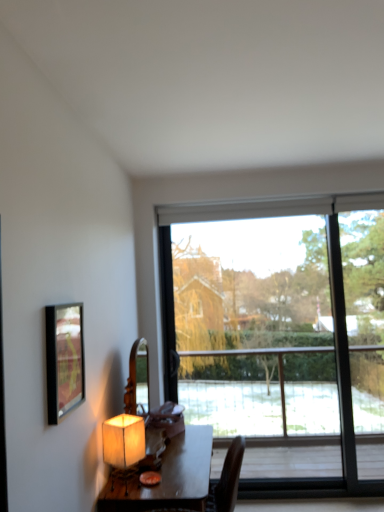
Measure the distance between matte beige lampshade at lower left and camera.

They are 6.83 feet apart.

This screenshot has height=512, width=384. What do you see at coordinates (64, 360) in the screenshot?
I see `metallic gold picture frame at upper left` at bounding box center [64, 360].

Find the location of `wooden table at center`. wooden table at center is located at coordinates (167, 477).

Considering the relative positions of metallic gold picture frame at upper left and transparent glass window at center in the image provided, is metallic gold picture frame at upper left to the left of transparent glass window at center from the viewer's perspective?

Correct, you'll find metallic gold picture frame at upper left to the left of transparent glass window at center.

Are metallic gold picture frame at upper left and transparent glass window at center beside each other?

metallic gold picture frame at upper left is not next to transparent glass window at center, and they're not touching.

Which point is more forward, (81,390) or (137,497)?

The point (81,390) is in front.

In the image, is metallic gold picture frame at upper left on the left side or the right side of wooden table at center?

Clearly, metallic gold picture frame at upper left is on the left of wooden table at center in the image.

Between metallic gold picture frame at upper left and wooden table at center, which one has more height?

Standing taller between the two is wooden table at center.

Is transparent glass window at center with matte beige lampshade at lower left?

No, transparent glass window at center is not touching matte beige lampshade at lower left.

From the image's perspective, which is above, transparent glass window at center or matte beige lampshade at lower left?

transparent glass window at center, from the image's perspective.

Is transparent glass window at center smaller than matte beige lampshade at lower left?

No, transparent glass window at center is not smaller than matte beige lampshade at lower left.

From a real-world perspective, which is physically above, matte beige lampshade at lower left or transparent glass window at center?

From a 3D spatial view, transparent glass window at center is above.

Is matte beige lampshade at lower left with transparent glass window at center?

There is a gap between matte beige lampshade at lower left and transparent glass window at center.

Which is more to the left, matte beige lampshade at lower left or transparent glass window at center?

Positioned to the left is matte beige lampshade at lower left.

Is point (133, 458) in front of point (47, 374)?

That is False.

How different are the orientations of matte beige lampshade at lower left and metallic gold picture frame at upper left in degrees?

The facing directions of matte beige lampshade at lower left and metallic gold picture frame at upper left are 59.8 degrees apart.

Considering the sizes of objects matte beige lampshade at lower left and metallic gold picture frame at upper left in the image provided, who is smaller, matte beige lampshade at lower left or metallic gold picture frame at upper left?

Smaller between the two is metallic gold picture frame at upper left.

Which of these two, matte beige lampshade at lower left or metallic gold picture frame at upper left, is wider?

matte beige lampshade at lower left is wider.

Is transparent glass window at center further to camera compared to wooden table at center?

Yes, transparent glass window at center is further from the viewer.

Is point (338, 405) closer or farther from the camera than point (133, 474)?

Point (338, 405).

From the image's perspective, which object appears higher, transparent glass window at center or wooden table at center?

transparent glass window at center, from the image's perspective.

Between transparent glass window at center and metallic gold picture frame at upper left, which one has more height?

With more height is transparent glass window at center.

Between transparent glass window at center and metallic gold picture frame at upper left, which one is positioned in front?

metallic gold picture frame at upper left.

In terms of width, does transparent glass window at center look wider or thinner when compared to metallic gold picture frame at upper left?

Clearly, transparent glass window at center has more width compared to metallic gold picture frame at upper left.

Looking at this image, would you consider transparent glass window at center to be distant from metallic gold picture frame at upper left?

That's right, there is a large distance between transparent glass window at center and metallic gold picture frame at upper left.

You are a GUI agent. You are given a task and a screenshot of the screen. Output one action in this format:
    pyautogui.click(x=<x>, y=<y>)
    Task: Click on the window behind the metallic gold picture frame at upper left
    Image resolution: width=384 pixels, height=512 pixels.
    Given the screenshot: What is the action you would take?
    pyautogui.click(x=281, y=334)

This screenshot has width=384, height=512. Identify the location of table below the metallic gold picture frame at upper left (from the image's perspective). (167, 477).

From the image, which object appears to be farther from metallic gold picture frame at upper left, transparent glass window at center or wooden table at center?

transparent glass window at center lies further to metallic gold picture frame at upper left than the other object.

Based on their spatial positions, is metallic gold picture frame at upper left or matte beige lampshade at lower left further from wooden table at center?

metallic gold picture frame at upper left is positioned further to the anchor wooden table at center.

Estimate the real-world distances between objects in this image. Which object is closer to metallic gold picture frame at upper left, matte beige lampshade at lower left or wooden table at center?

matte beige lampshade at lower left is closer to metallic gold picture frame at upper left.

Based on the photo, estimate the real-world distances between objects in this image. Which object is further from matte beige lampshade at lower left, transparent glass window at center or metallic gold picture frame at upper left?

transparent glass window at center is positioned further to the anchor matte beige lampshade at lower left.

From the image, which object appears to be nearer to wooden table at center, matte beige lampshade at lower left or metallic gold picture frame at upper left?

matte beige lampshade at lower left lies closer to wooden table at center than the other object.

Estimate the real-world distances between objects in this image. Which object is further from metallic gold picture frame at upper left, wooden table at center or transparent glass window at center?

Based on the image, transparent glass window at center appears to be further to metallic gold picture frame at upper left.

Considering their positions, is transparent glass window at center positioned further to wooden table at center than matte beige lampshade at lower left?

transparent glass window at center.

Which object lies further to the anchor point matte beige lampshade at lower left, metallic gold picture frame at upper left or transparent glass window at center?

Based on the image, transparent glass window at center appears to be further to matte beige lampshade at lower left.

This screenshot has height=512, width=384. What are the coordinates of `lamp between metallic gold picture frame at upper left and wooden table at center in the vertical direction` in the screenshot? It's located at (123, 445).

Where is `table between metallic gold picture frame at upper left and transparent glass window at center along the z-axis`? The width and height of the screenshot is (384, 512). table between metallic gold picture frame at upper left and transparent glass window at center along the z-axis is located at coordinates (167, 477).

Where is `lamp between metallic gold picture frame at upper left and transparent glass window at center in the front-back direction`? The height and width of the screenshot is (512, 384). lamp between metallic gold picture frame at upper left and transparent glass window at center in the front-back direction is located at coordinates (123, 445).

At what (x,y) coordinates should I click in order to perform the action: click on lamp between wooden table at center and transparent glass window at center along the z-axis. Please return your answer as a coordinate pair (x, y). The height and width of the screenshot is (512, 384). Looking at the image, I should click on (123, 445).